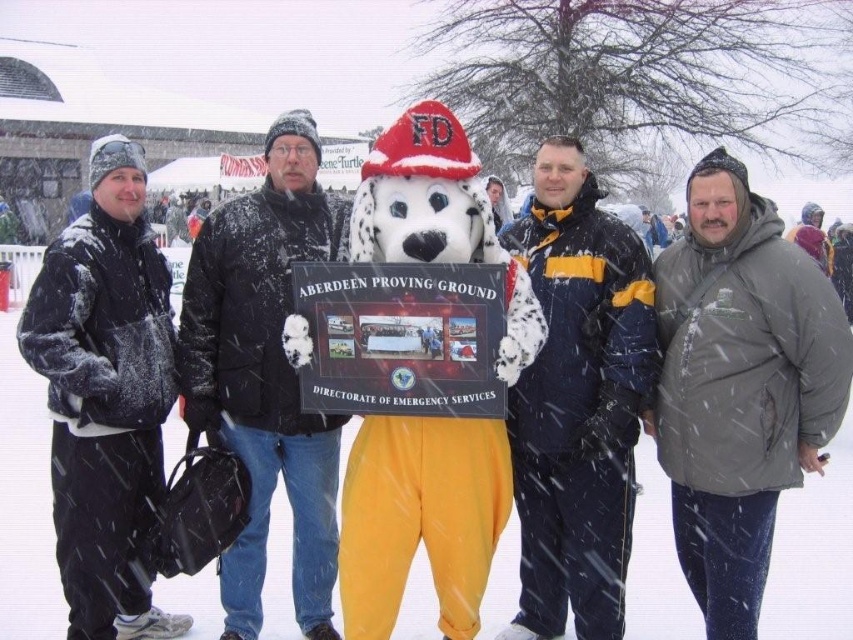
Identify the location of matte black jacket at left. This screenshot has height=640, width=853. (105, 396).

Which is in front, point (74, 488) or point (260, 516)?

Positioned in front is point (74, 488).

This screenshot has height=640, width=853. What are the coordinates of `matte black jacket at left` in the screenshot? It's located at (105, 396).

Is navy blue jacket at center closer to the viewer compared to matte black jacket at center?

No, navy blue jacket at center is behind matte black jacket at center.

Looking at this image, is navy blue jacket at center to the left of matte black jacket at center from the viewer's perspective?

Incorrect, navy blue jacket at center is not on the left side of matte black jacket at center.

The image size is (853, 640). Describe the element at coordinates (577, 401) in the screenshot. I see `navy blue jacket at center` at that location.

Where is `navy blue jacket at center`? This screenshot has height=640, width=853. navy blue jacket at center is located at coordinates click(577, 401).

Measure the distance between point (x=718, y=440) and camera.

A distance of 24.68 meters exists between point (x=718, y=440) and camera.

Which is more to the right, gray fuzzy jacket at right or matte black jacket at center?

Positioned to the right is gray fuzzy jacket at right.

Where is `gray fuzzy jacket at right`? The height and width of the screenshot is (640, 853). gray fuzzy jacket at right is located at coordinates (740, 385).